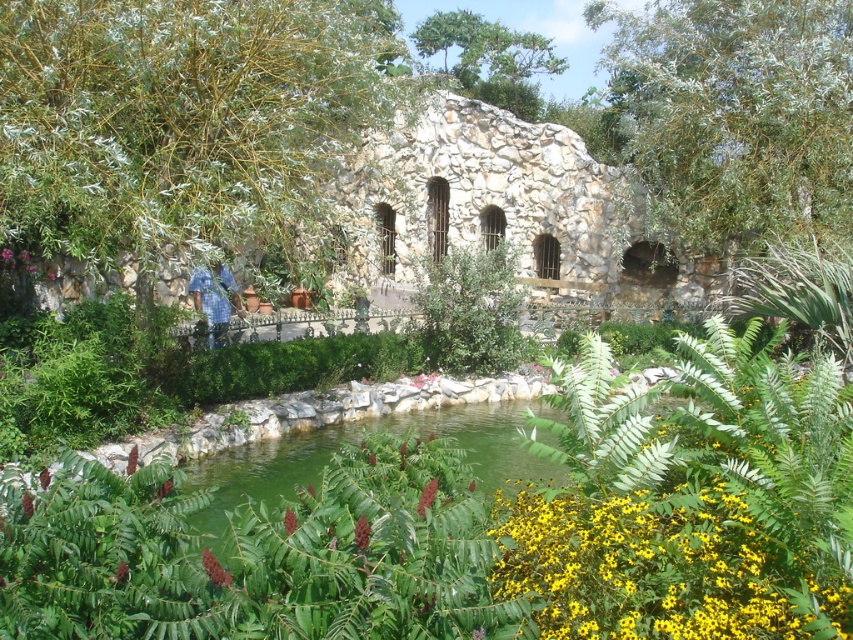
In the scene shown: You are a photographer taking a picture of the garden scene. You want to ensure both the blue plaid shirt at center and the vivid red flower at center are in the frame. Which object should you place closer to the left side of your camera viewfinder to achieve this?

The blue plaid shirt at center is positioned on the left side of the vivid red flower at center. To have both in the frame with the blue plaid shirt at center on the left, position the camera so the blue plaid shirt at center is near the left edge and the vivid red flower at center is towards the right side of the viewfinder.

Consider the image. You are standing in the garden scene and see the blue plaid shirt at center and the vivid red flower at center. Which object is taller?

The blue plaid shirt at center is much taller than the vivid red flower at center.